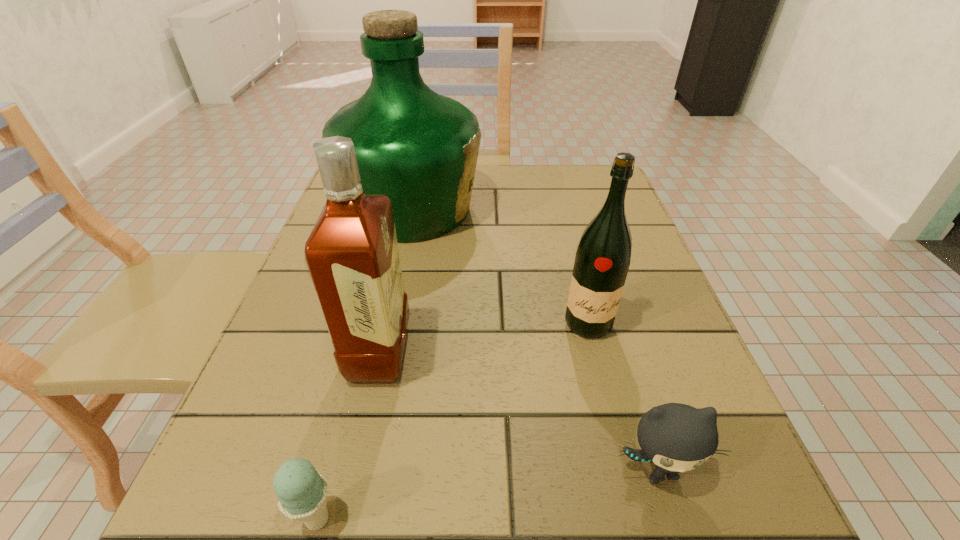
Locate an element on the screen. object that is the third closest to the kitten is located at coordinates (301, 490).

Point out which liquor is positioned as the second nearest to the ice cream. Please provide its 2D coordinates. Your answer should be formatted as a tuple, i.e. [(x, y)], where the tuple contains the x and y coordinates of a point satisfying the conditions above.

[(602, 260)]

This screenshot has height=540, width=960. Identify the location of liquor that can be found as the closest to the rightmost liquor. (419, 148).